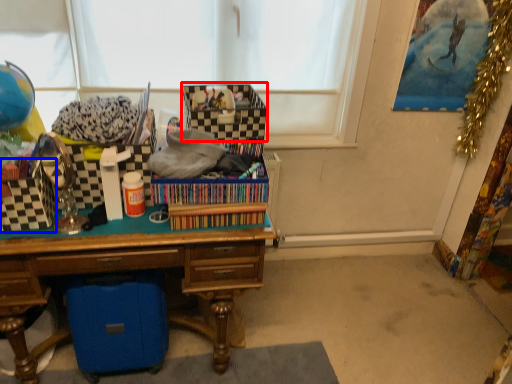
Question: Which point is closer to the camera, storage box (highlighted by a red box) or storage box (highlighted by a blue box)?

Choices:
 (A) storage box
 (B) storage box

Answer: (B)